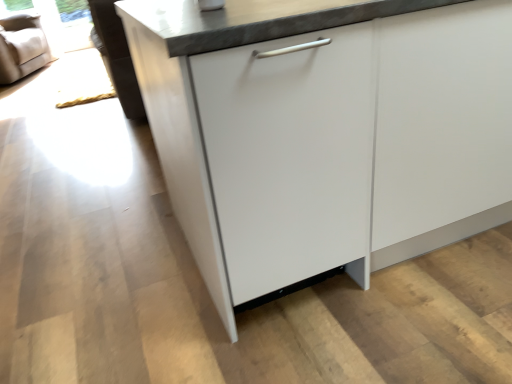
Question: Based on their sizes in the image, would you say white glossy cabinet at center is bigger or smaller than transparent glass window screen at upper left?

Choices:
 (A) small
 (B) big

Answer: (B)

Question: From their relative heights in the image, would you say white glossy cabinet at center is taller or shorter than transparent glass window screen at upper left?

Choices:
 (A) short
 (B) tall

Answer: (B)

Question: Which of these objects is positioned closest to the white glossy cabinet at center?

Choices:
 (A) transparent glass window screen at upper left
 (B) beige fabric armchair at upper left

Answer: (B)

Question: Estimate the real-world distances between objects in this image. Which object is closer to the white glossy cabinet at center?

Choices:
 (A) transparent glass window screen at upper left
 (B) beige fabric armchair at upper left

Answer: (B)